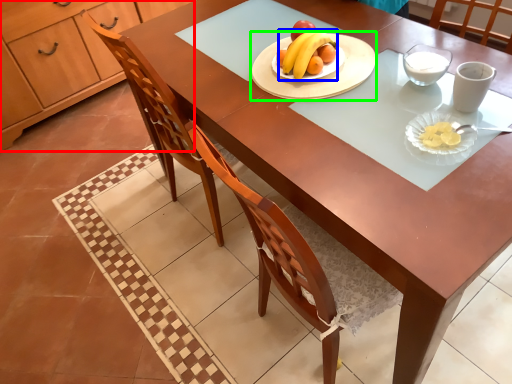
Question: Estimate the real-world distances between objects in this image. Which object is closer to cabinetry (highlighted by a red box), banana (highlighted by a blue box) or platter (highlighted by a green box)?

Choices:
 (A) banana
 (B) platter

Answer: (B)